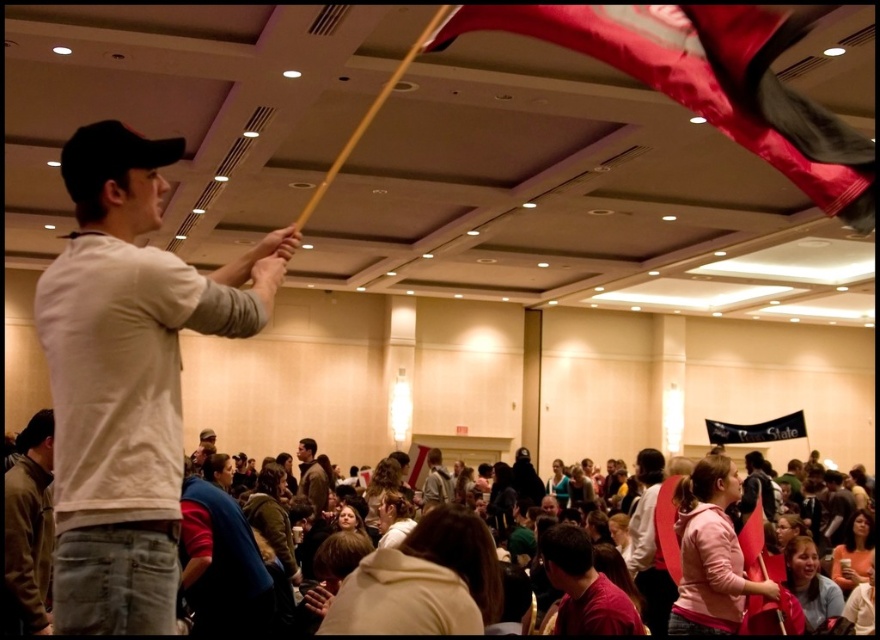
Does red fabric flag at upper right have a smaller size compared to brown leather jacket at center?

No, red fabric flag at upper right is not smaller than brown leather jacket at center.

At what (x,y) coordinates should I click in order to perform the action: click on red fabric flag at upper right. Please return your answer as a coordinate pair (x, y). The height and width of the screenshot is (640, 880). Looking at the image, I should click on (710, 81).

Does point (705, 76) come in front of point (310, 490)?

Yes.

Find the location of `red fabric flag at upper right`. red fabric flag at upper right is located at coordinates (710, 81).

Is point (793, 22) positioned before point (428, 476)?

Yes.

Between red fabric flag at upper right and light brown leather jacket at center, which one appears on the right side from the viewer's perspective?

From the viewer's perspective, red fabric flag at upper right appears more on the right side.

The height and width of the screenshot is (640, 880). What do you see at coordinates (710, 81) in the screenshot? I see `red fabric flag at upper right` at bounding box center [710, 81].

In order to click on red fabric flag at upper right in this screenshot , I will do `click(710, 81)`.

Can you confirm if dark brown leather jacket at lower left is shorter than black fabric banner at upper center?

No, dark brown leather jacket at lower left is not shorter than black fabric banner at upper center.

Consider the image. Can you confirm if dark brown leather jacket at lower left is positioned to the right of black fabric banner at upper center?

Result: Incorrect, dark brown leather jacket at lower left is not on the right side of black fabric banner at upper center.

Between point (46, 605) and point (714, 422), which one is positioned behind?

Positioned behind is point (714, 422).

Locate an element on the screen. dark brown leather jacket at lower left is located at coordinates (28, 529).